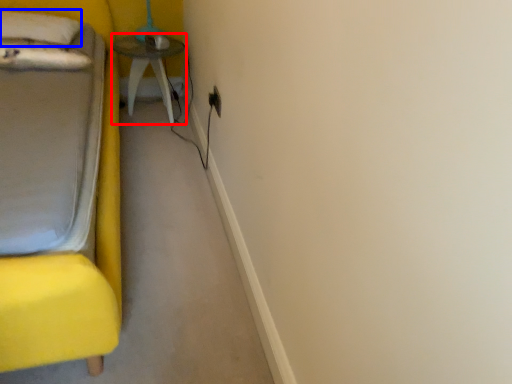
Question: Among these objects, which one is farthest to the camera, table (highlighted by a red box) or pillow (highlighted by a blue box)?

Choices:
 (A) table
 (B) pillow

Answer: (A)